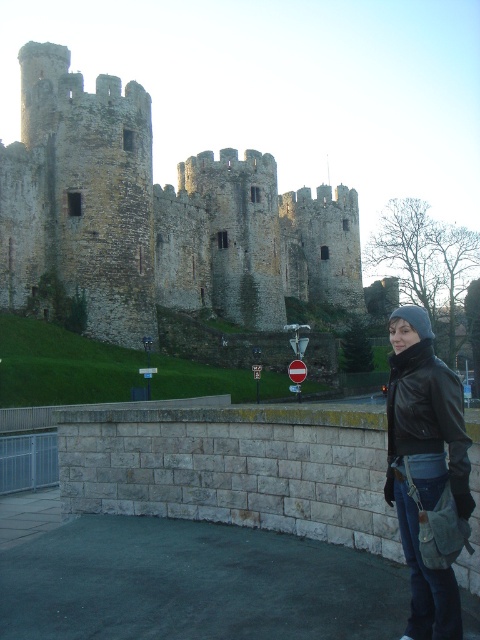
Question: Can you confirm if weathered stone castle at upper left is positioned below black leather jacket at lower right?

Choices:
 (A) yes
 (B) no

Answer: (B)

Question: Is weathered stone castle at upper left wider than black leather jacket at lower right?

Choices:
 (A) no
 (B) yes

Answer: (B)

Question: Which point is farther to the camera?

Choices:
 (A) [x=223, y=198]
 (B) [x=435, y=365]

Answer: (A)

Question: Considering the relative positions of weathered stone castle at upper left and black leather jacket at lower right in the image provided, where is weathered stone castle at upper left located with respect to black leather jacket at lower right?

Choices:
 (A) right
 (B) left

Answer: (B)